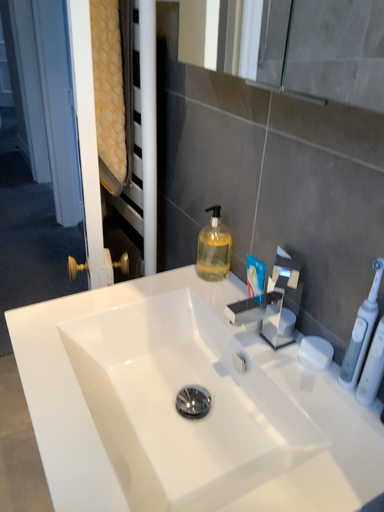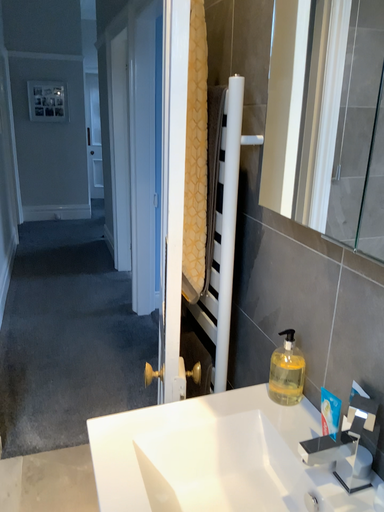
Question: Which way did the camera rotate in the video?

Choices:
 (A) rotated downward
 (B) rotated upward

Answer: (B)